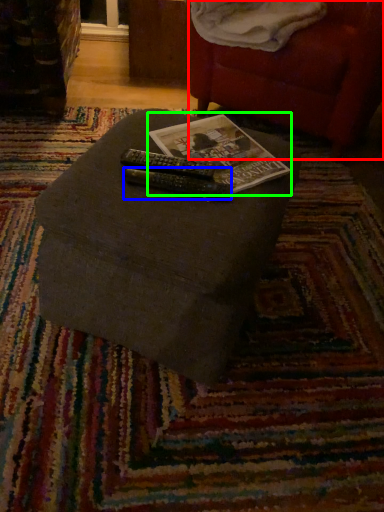
Question: Estimate the real-world distances between objects in this image. Which object is closer to bean bag chair (highlighted by a red box), remote (highlighted by a blue box) or paperback book (highlighted by a green box)?

Choices:
 (A) remote
 (B) paperback book

Answer: (B)